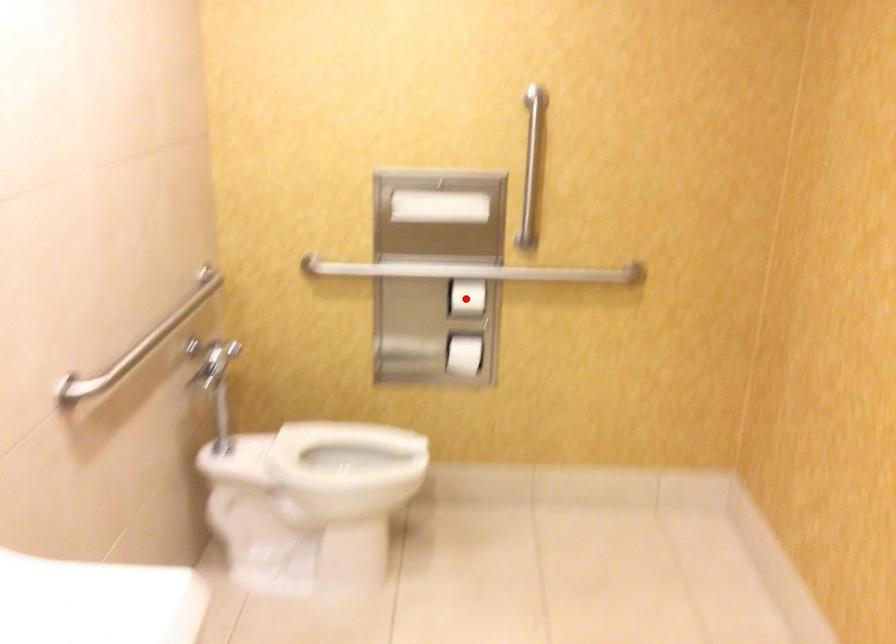
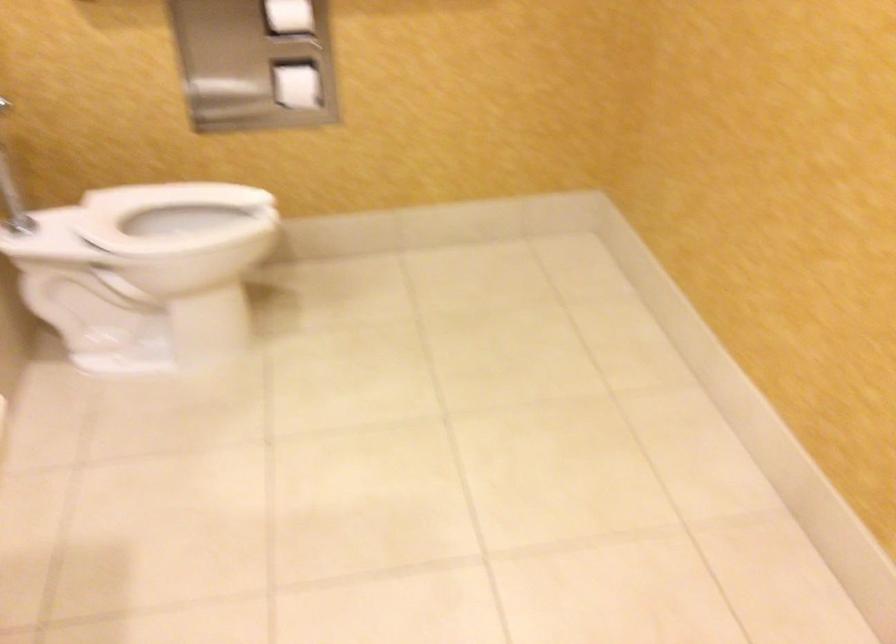
Locate, in the second image, the point that corresponds to the highlighted location in the first image.

(289, 15)